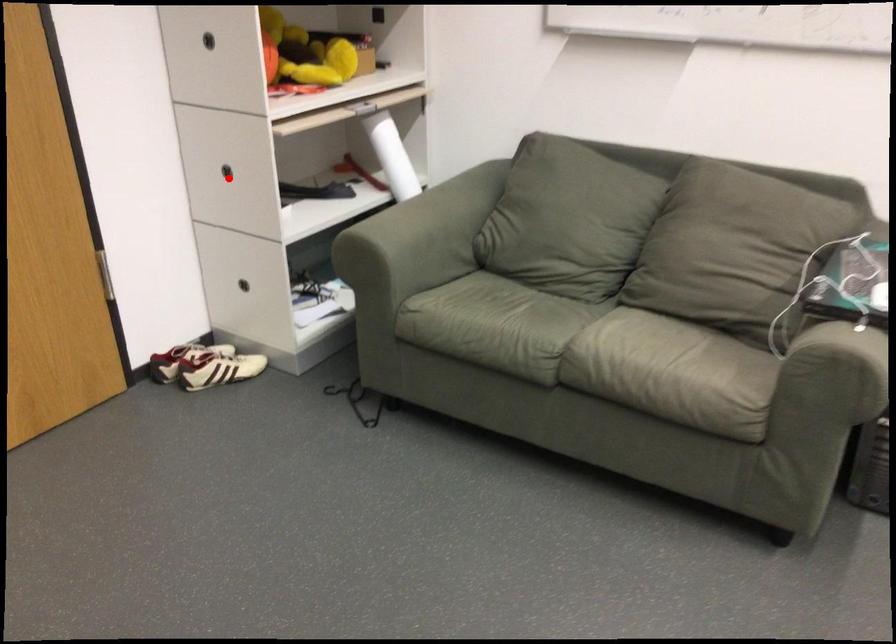
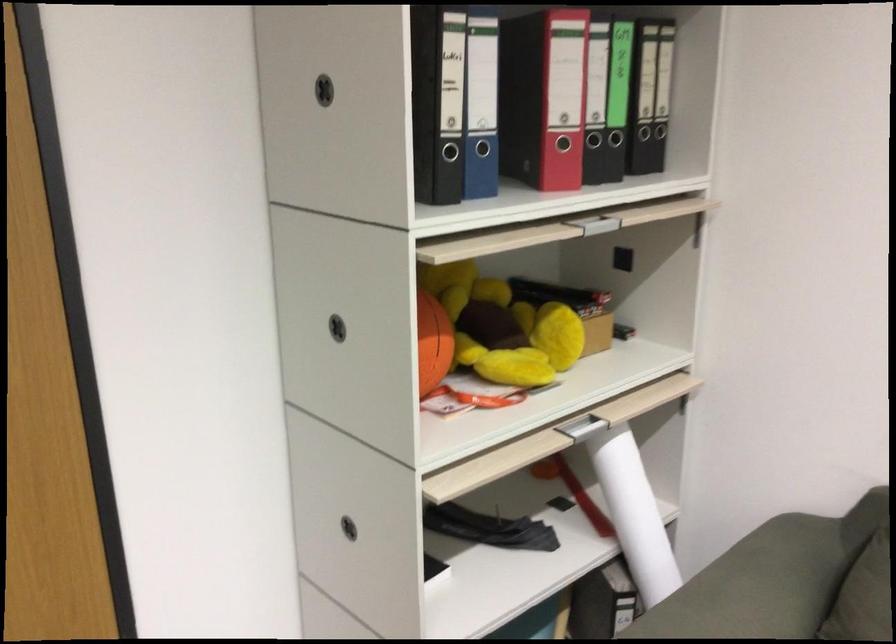
Find the pixel in the second image that matches the highlighted location in the first image.

(348, 527)